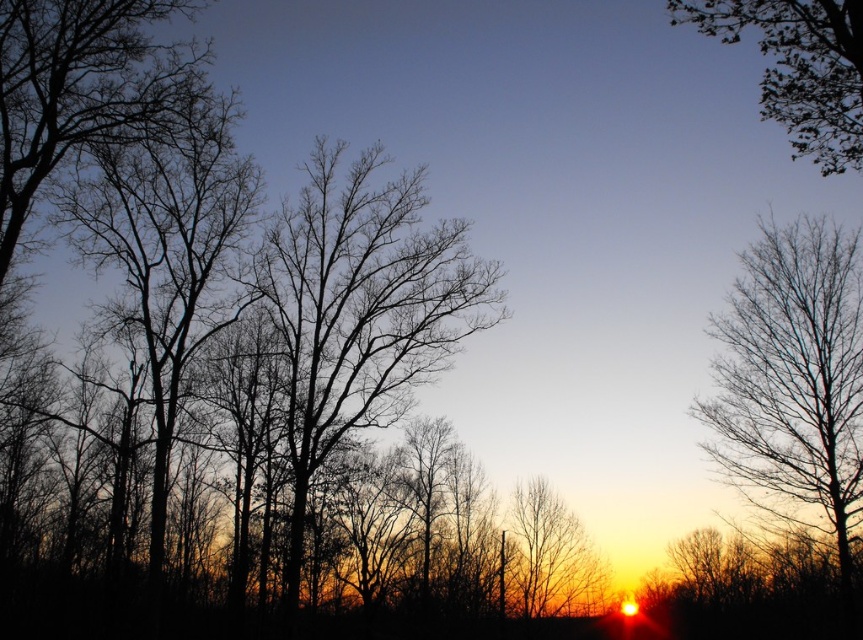
Question: Can you confirm if black bare tree at center is positioned to the left of green leafy tree at upper right?

Choices:
 (A) no
 (B) yes

Answer: (B)

Question: Among these points, which one is nearest to the camera?

Choices:
 (A) click(514, 524)
 (B) click(433, 280)
 (C) click(742, 6)
 (D) click(0, 273)

Answer: (C)

Question: Does green leafy tree at upper right have a greater width compared to smooth bark tree at center?

Choices:
 (A) no
 (B) yes

Answer: (B)

Question: Which object is farther from the camera taking this photo?

Choices:
 (A) smooth bark tree at center
 (B) black bare tree at center

Answer: (A)

Question: Based on their relative distances, which object is farther from the bare branches at right?

Choices:
 (A) green leafy tree at upper right
 (B) black bare tree at center
 (C) smooth bark tree at center
 (D) bare branches at left

Answer: (D)

Question: Does bare branches at left appear on the right side of green leafy tree at upper right?

Choices:
 (A) no
 (B) yes

Answer: (A)